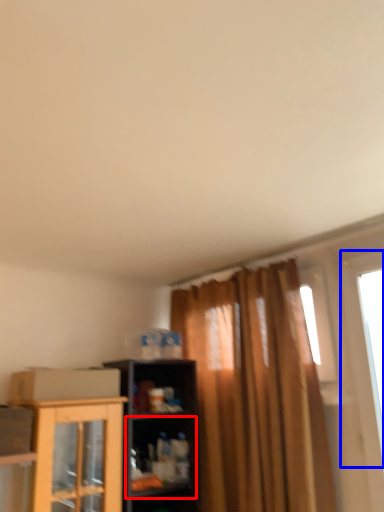
Question: Which of the following is the farthest to the observer, shelf (highlighted by a red box) or window (highlighted by a blue box)?

Choices:
 (A) shelf
 (B) window

Answer: (A)